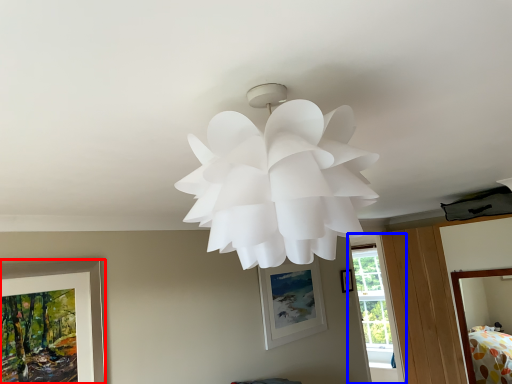
Question: Which point is further to the camera, picture frame (highlighted by a red box) or window (highlighted by a blue box)?

Choices:
 (A) picture frame
 (B) window

Answer: (B)